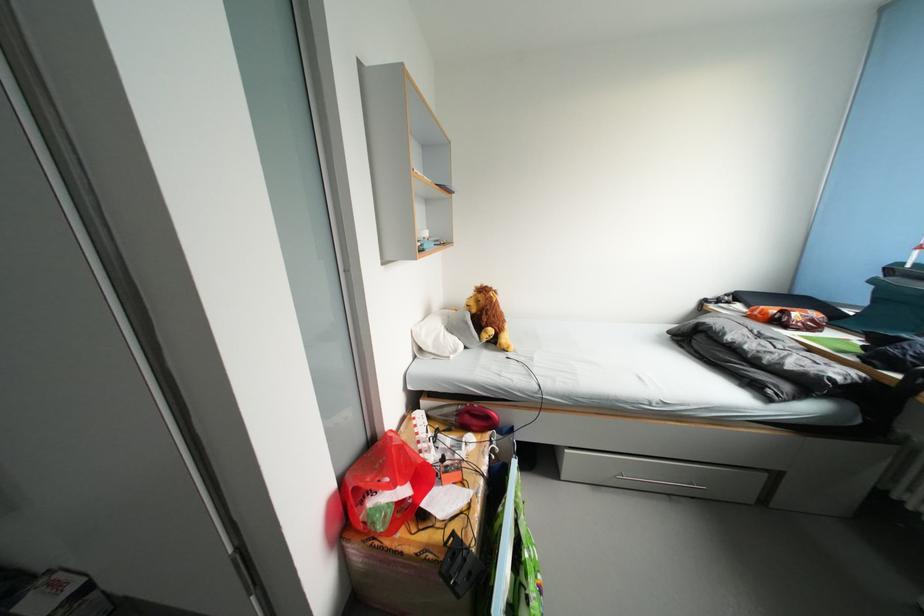
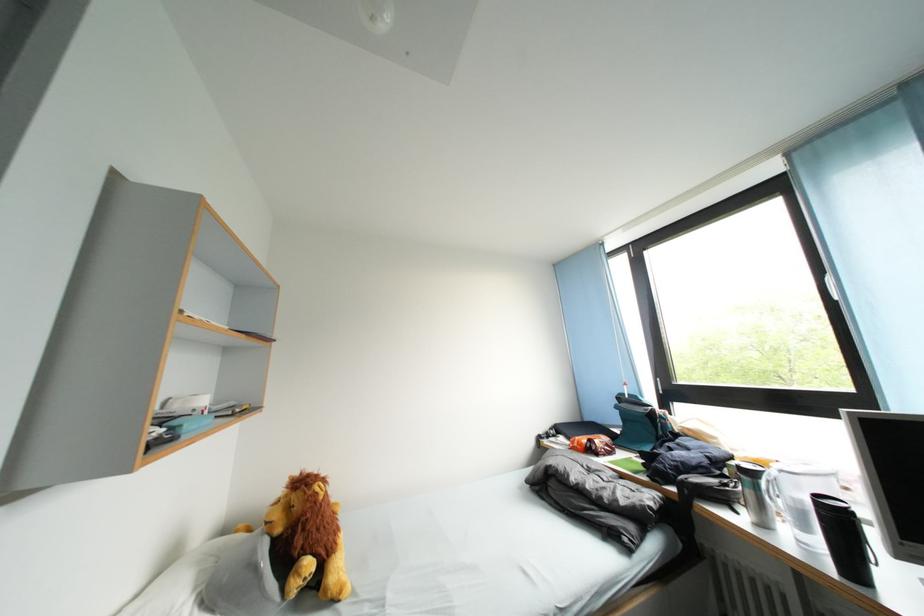
In the second image, find the point that corresponds to pixel 482 315 in the first image.

(287, 535)